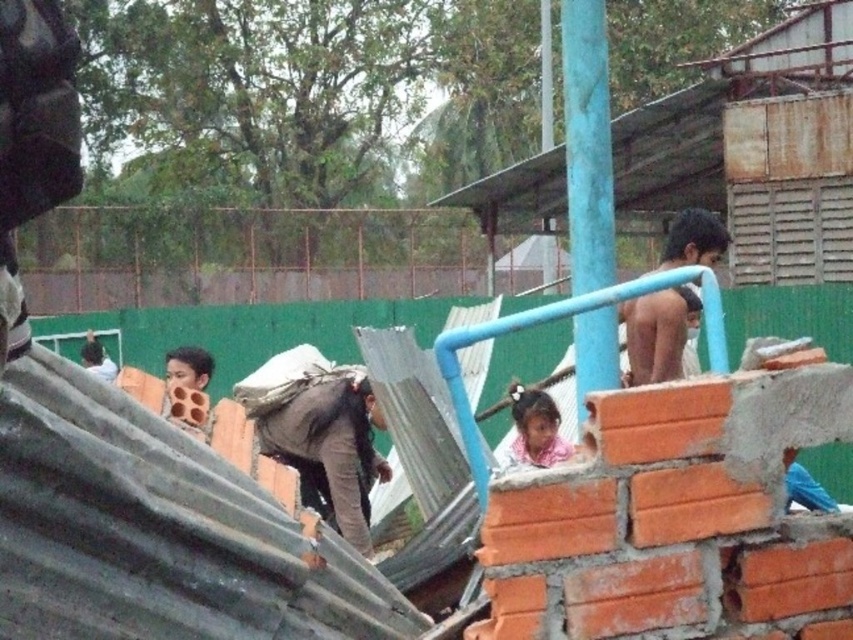
Between blue painted metal pole at upper center and dark skin man at upper right, which one has more height?

blue painted metal pole at upper center is taller.

Between point (590, 259) and point (711, 244), which one is positioned in front?

Point (590, 259)

Between point (606, 163) and point (682, 376), which one is positioned behind?

Point (682, 376)

You are a GUI agent. You are given a task and a screenshot of the screen. Output one action in this format:
    pyautogui.click(x=<x>, y=<y>)
    Task: Click on the blue painted metal pole at upper center
    
    Given the screenshot: What is the action you would take?
    pyautogui.click(x=587, y=145)

Which is above, blue painted metal pole at upper center or light brown fabric shirt at left?

Positioned higher is blue painted metal pole at upper center.

Is blue painted metal pole at upper center taller than light brown fabric shirt at left?

Indeed, blue painted metal pole at upper center has a greater height compared to light brown fabric shirt at left.

Is point (593, 19) more distant than point (85, 355)?

No, it is not.

At what (x,y) coordinates should I click in order to perform the action: click on blue painted metal pole at upper center. Please return your answer as a coordinate pair (x, y). This screenshot has width=853, height=640. Looking at the image, I should click on (587, 145).

Is dark skin man at upper right taller than pink fabric at upper center?

Correct, dark skin man at upper right is much taller as pink fabric at upper center.

Describe the element at coordinates (654, 336) in the screenshot. I see `dark skin man at upper right` at that location.

Is point (705, 244) closer to viewer compared to point (561, 444)?

Yes, it is.

Locate an element on the screen. The image size is (853, 640). dark skin man at upper right is located at coordinates (654, 336).